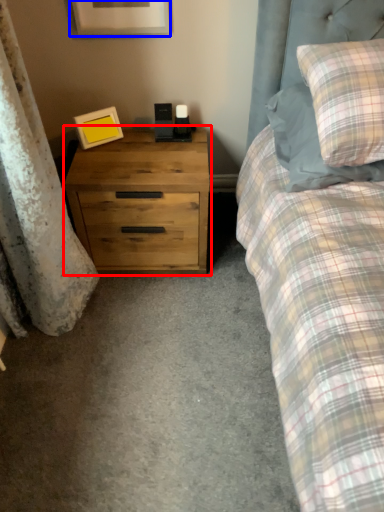
Question: Which object appears farthest to the camera in this image, chest of drawers (highlighted by a red box) or picture frame (highlighted by a blue box)?

Choices:
 (A) chest of drawers
 (B) picture frame

Answer: (A)